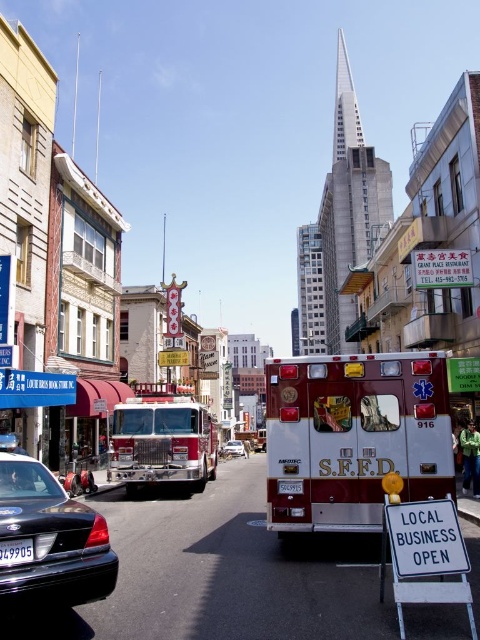
You are a delivery driver who needs to park your truck between the white plastic license plate at center and the metallic silver car at center. The length of your truck is 12 meters. Is there enough space between them for your truck?

The distance between the white plastic license plate at center and the metallic silver car at center is 42.66 meters. Since your truck is only 12 meters long, there is more than enough space to park between them.

You are a pedestrian standing on the sidewalk and want to cross the street to reach the Transamerica Pyramid building. The shiny red fire truck at center and metallic silver car at center are blocking your path. Which vehicle should you move around to get to the other side?

The shiny red fire truck at center is positioned over metallic silver car at center, so you should move around the metallic silver car at center since it is underneath and less obstructive.

You are a delivery driver who needs to park your van near the white plastic license plate at center and the metallic silver car at center. Based on the scene, can you determine which object is closer to the parking spot you need to occupy?

The white plastic license plate at center is above the metallic silver car at center, so the metallic silver car at center is closer to the parking spot since it is positioned lower in the frame.